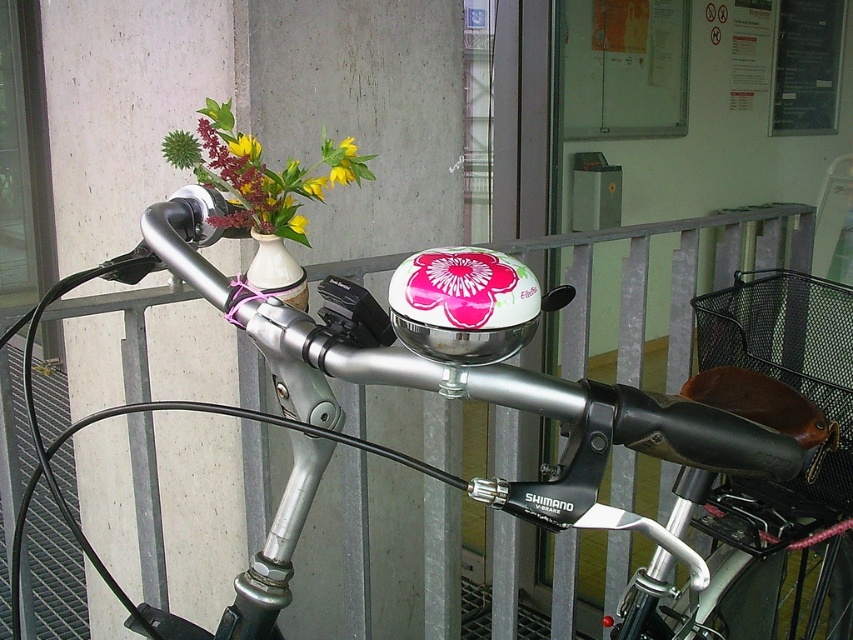
You are a delivery person trying to attach a package to your bicycle handlebars. The package is 5 inches long. There is space between the matte ceramic vase at upper left and the white matte vase at upper center. Can you fit the package between them?

The distance between the matte ceramic vase at upper left and the white matte vase at upper center is 5.30 inches. Since the package is 5 inches long, it can fit between them as the available space is slightly larger than the package.

You are a delivery person who needs to attach a GPS tracker to the shiny metallic bicycle handlebar at center. The GPS tracker must be placed exactly at point (540, 417). Can you confirm the exact location of the shiny metallic bicycle handlebar at center?

The shiny metallic bicycle handlebar at center is located at point (540, 417), so the GPS tracker should be placed there.